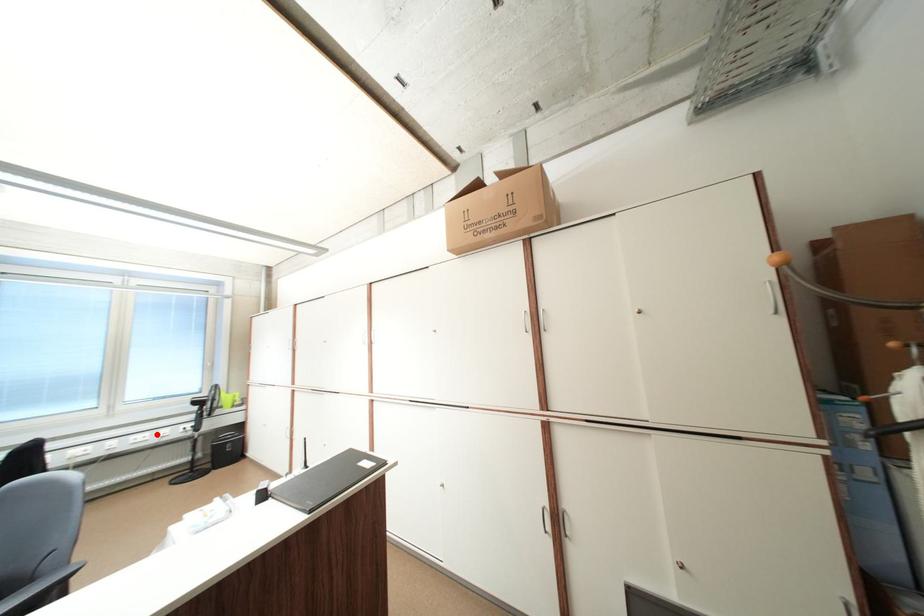
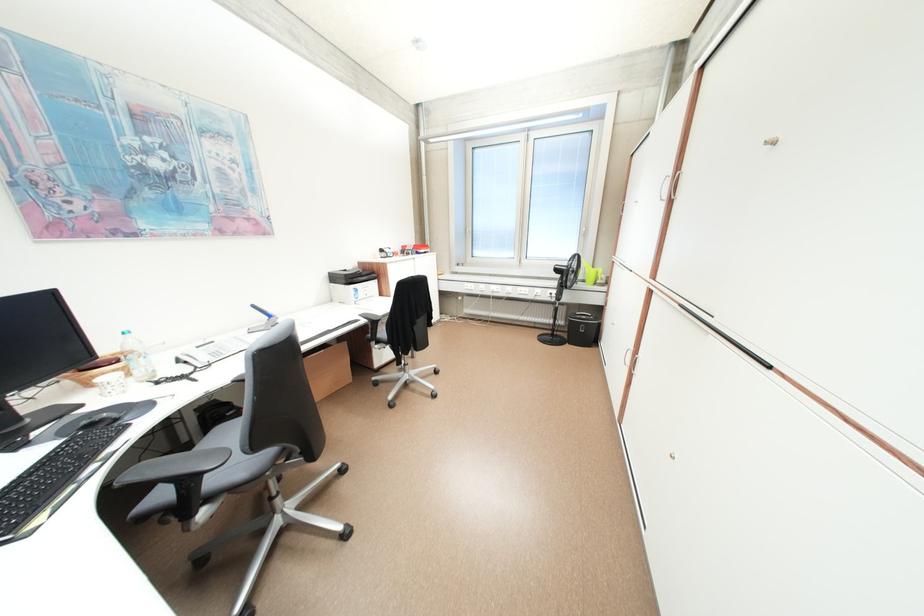
In the second image, find the point that corresponds to the highlighted location in the first image.

(537, 290)